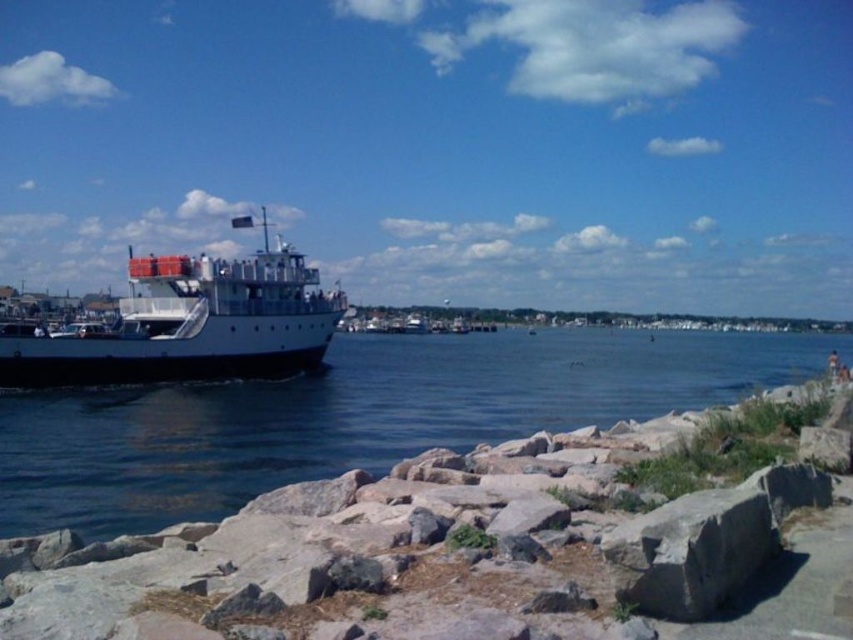
Question: Is blue water at left above white matte boat at left?

Choices:
 (A) no
 (B) yes

Answer: (A)

Question: Is blue water at left positioned before white matte boat at left?

Choices:
 (A) yes
 (B) no

Answer: (A)

Question: Can you confirm if blue water at left is smaller than white matte boat at left?

Choices:
 (A) no
 (B) yes

Answer: (B)

Question: Among these points, which one is nearest to the camera?

Choices:
 (A) (190, 328)
 (B) (544, 337)

Answer: (A)

Question: Which point is closer to the camera?

Choices:
 (A) blue water at left
 (B) white matte boat at left

Answer: (A)